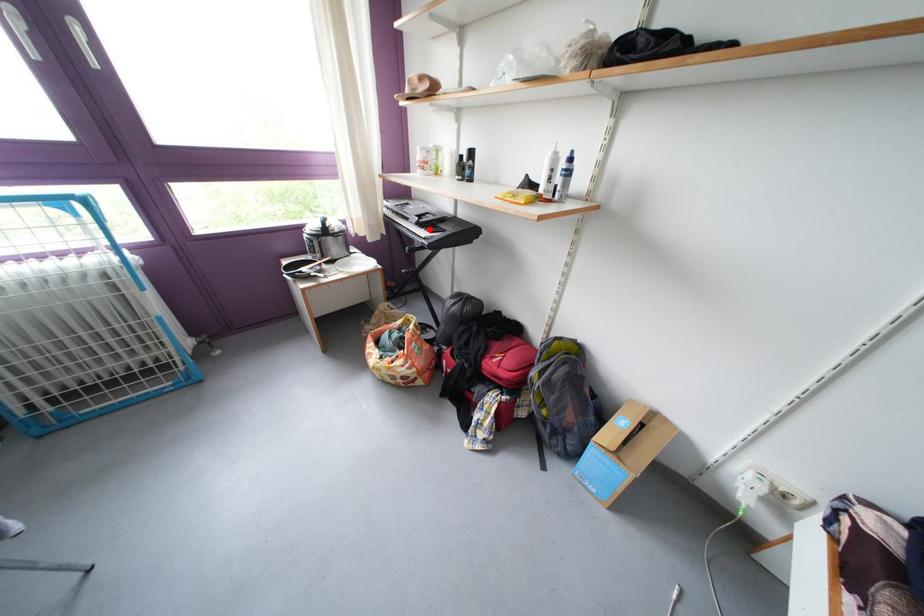
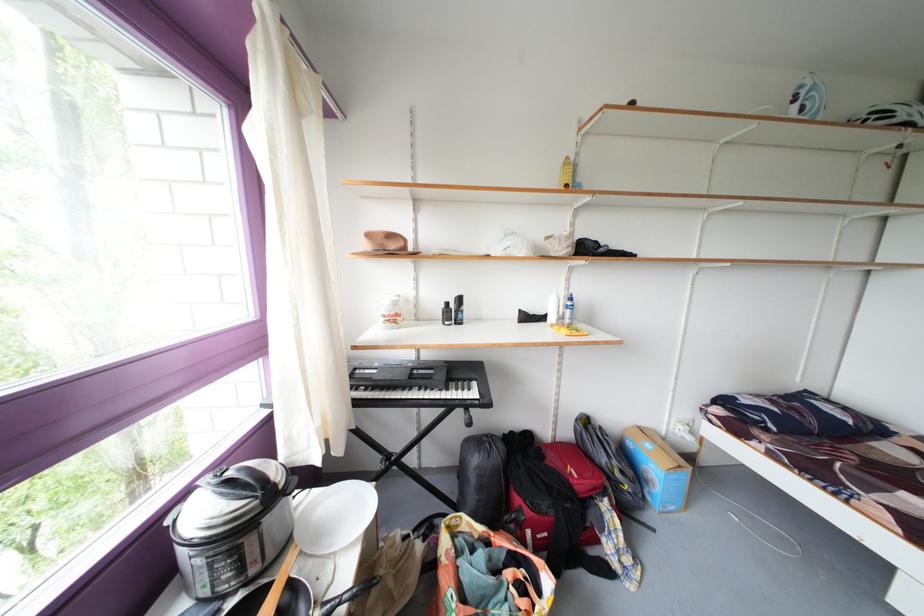
Question: I am providing you with two images of the same scene from different viewpoints. A red point is marked on the first image. Is the red point's position out of view in image 2?

Choices:
 (A) Yes
 (B) No

Answer: (A)